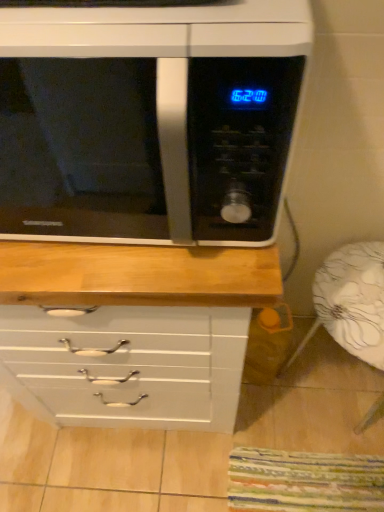
Question: Is black glossy microwave at upper center taller than white floral fabric armchair at lower right?

Choices:
 (A) no
 (B) yes

Answer: (A)

Question: Is black glossy microwave at upper center facing towards white floral fabric armchair at lower right?

Choices:
 (A) no
 (B) yes

Answer: (A)

Question: From a real-world perspective, is black glossy microwave at upper center below white floral fabric armchair at lower right?

Choices:
 (A) no
 (B) yes

Answer: (A)

Question: Does black glossy microwave at upper center have a lesser height compared to white floral fabric armchair at lower right?

Choices:
 (A) yes
 (B) no

Answer: (A)

Question: Considering the relative positions of black glossy microwave at upper center and white floral fabric armchair at lower right in the image provided, is black glossy microwave at upper center to the left of white floral fabric armchair at lower right from the viewer's perspective?

Choices:
 (A) yes
 (B) no

Answer: (A)

Question: From a real-world perspective, is black glossy microwave at upper center over white floral fabric armchair at lower right?

Choices:
 (A) yes
 (B) no

Answer: (A)

Question: Is there a large distance between white floral fabric armchair at lower right and black glossy microwave at upper center?

Choices:
 (A) yes
 (B) no

Answer: (A)

Question: Does white floral fabric armchair at lower right come behind black glossy microwave at upper center?

Choices:
 (A) no
 (B) yes

Answer: (B)

Question: Is black glossy microwave at upper center completely or partially inside white floral fabric armchair at lower right?

Choices:
 (A) no
 (B) yes

Answer: (A)

Question: Is white floral fabric armchair at lower right turned away from black glossy microwave at upper center?

Choices:
 (A) no
 (B) yes

Answer: (A)

Question: From the image's perspective, is white floral fabric armchair at lower right located beneath black glossy microwave at upper center?

Choices:
 (A) no
 (B) yes

Answer: (B)

Question: From the image's perspective, is white floral fabric armchair at lower right over black glossy microwave at upper center?

Choices:
 (A) no
 (B) yes

Answer: (A)

Question: Considering the positions of black glossy microwave at upper center and white floral fabric armchair at lower right in the image, is black glossy microwave at upper center taller or shorter than white floral fabric armchair at lower right?

Choices:
 (A) short
 (B) tall

Answer: (A)